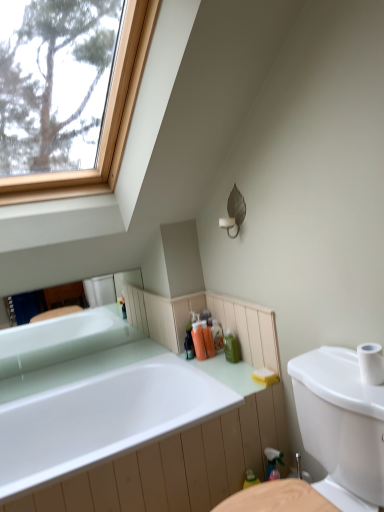
At what (x,y) coordinates should I click in order to perform the action: click on vacant area to the left of yellow sponge at lower right. Please return your answer as a coordinate pair (x, y). This screenshot has height=512, width=384. Looking at the image, I should click on (239, 388).